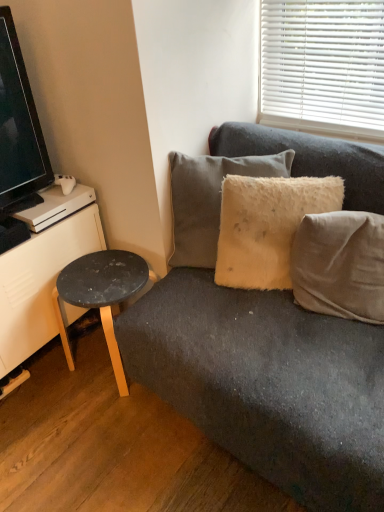
What are the coordinates of `empty space that is ontop of black laminate stool at lower left (from a real-world perspective)` in the screenshot? It's located at (95, 273).